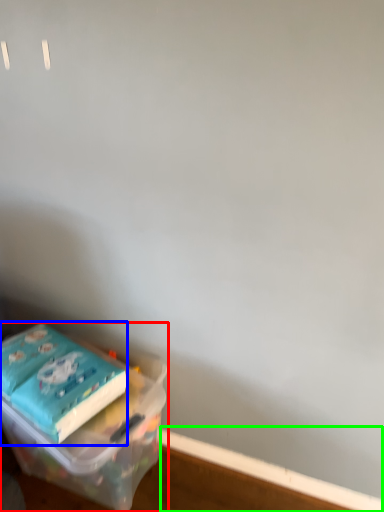
Question: Which object is the farthest from box (highlighted by a red box)? Choose among these: paperback book (highlighted by a blue box) or window sill (highlighted by a green box).

Choices:
 (A) paperback book
 (B) window sill

Answer: (B)